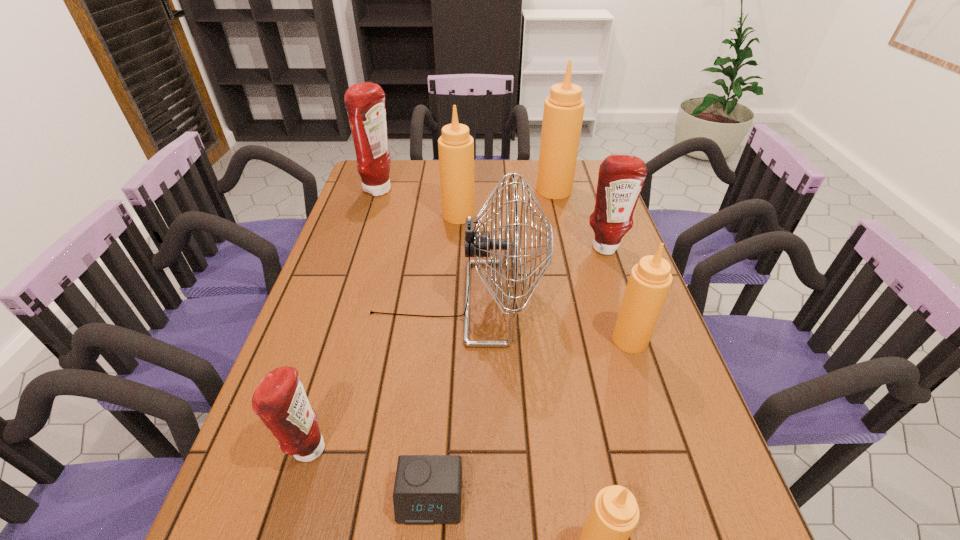
Identify the location of the farthest tan condiment. The height and width of the screenshot is (540, 960). (563, 113).

At what (x,y) coordinates should I click in order to perform the action: click on the tallest condiment. Please return your answer as a coordinate pair (x, y). This screenshot has height=540, width=960. Looking at the image, I should click on (563, 113).

Identify the location of the fifth nearest condiment. The image size is (960, 540). (456, 147).

Locate an element on the screen. This screenshot has height=540, width=960. the third condiment from left to right is located at coordinates (456, 147).

Locate an element on the screen. The width and height of the screenshot is (960, 540). the biggest red condiment is located at coordinates (365, 102).

Identify the location of fan. The width and height of the screenshot is (960, 540). (478, 244).

What are the coordinates of `the second nearest red condiment` in the screenshot? It's located at (621, 177).

Locate an element on the screen. This screenshot has height=540, width=960. the fourth farthest object is located at coordinates (621, 177).

Identify the location of the second smallest tan condiment. (649, 282).

I want to click on the second nearest tan condiment, so (x=649, y=282).